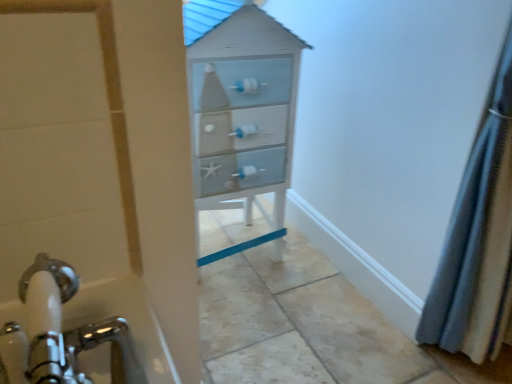
In order to click on vacant area located to the right-hand side of light blue painted wood chest of drawers at center in this screenshot , I will do `click(315, 281)`.